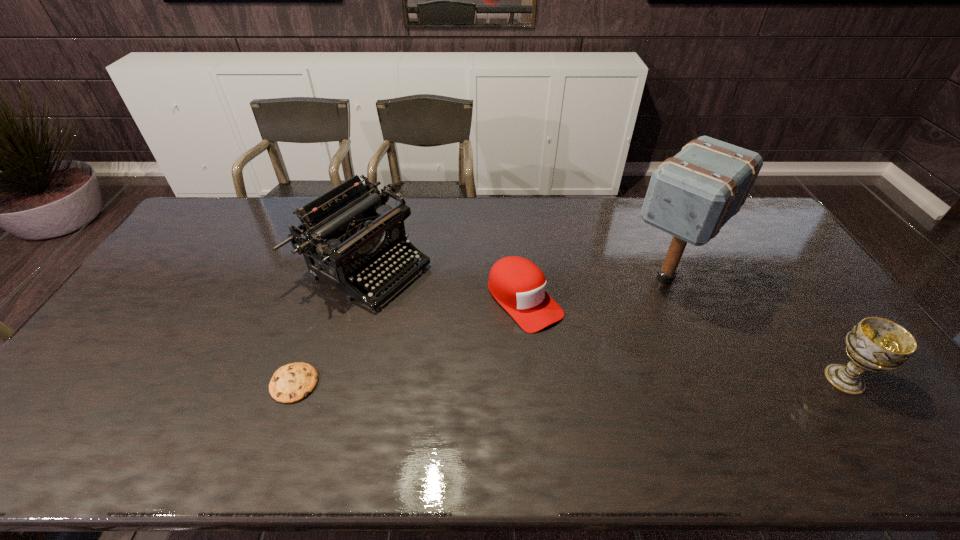
This screenshot has width=960, height=540. What are the coordinates of `cookie` in the screenshot? It's located at (293, 382).

The image size is (960, 540). Identify the location of chalice. (877, 344).

The image size is (960, 540). What are the coordinates of `the rightmost object` in the screenshot? It's located at (877, 344).

Identify the location of the second tallest object. This screenshot has width=960, height=540. [349, 233].

Locate an element on the screen. baseball cap is located at coordinates (518, 285).

Where is `the third object from left to right`? Image resolution: width=960 pixels, height=540 pixels. the third object from left to right is located at coordinates (518, 285).

The width and height of the screenshot is (960, 540). Find the location of `the second object from right to left`. the second object from right to left is located at coordinates (692, 195).

Identify the location of mallet. (692, 195).

Where is `vacant space situated on the right of the cookie`? vacant space situated on the right of the cookie is located at coordinates (365, 383).

The height and width of the screenshot is (540, 960). In order to click on blank space located 0.050m on the left of the third shortest object in this screenshot , I will do `click(802, 379)`.